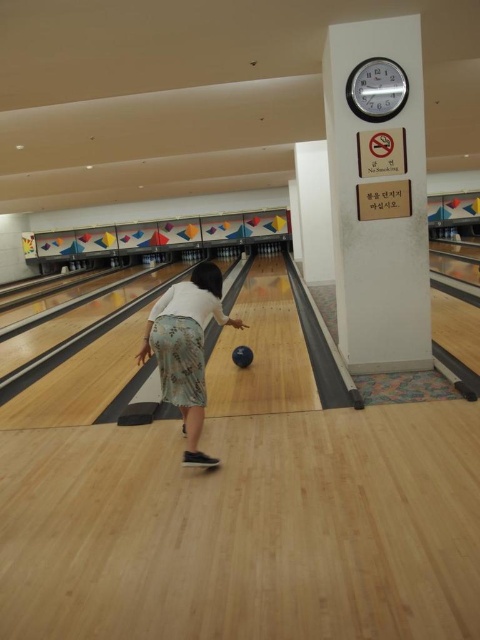
Question: Does floral skirt at center appear on the left side of shiny blue bowling ball at center?

Choices:
 (A) yes
 (B) no

Answer: (A)

Question: Can you confirm if floral skirt at center is positioned above shiny blue bowling ball at center?

Choices:
 (A) no
 (B) yes

Answer: (A)

Question: From the image, what is the correct spatial relationship of floral skirt at center in relation to shiny blue bowling ball at center?

Choices:
 (A) above
 (B) below

Answer: (B)

Question: Which point is farther to the camera?

Choices:
 (A) shiny blue bowling ball at center
 (B) floral skirt at center

Answer: (A)